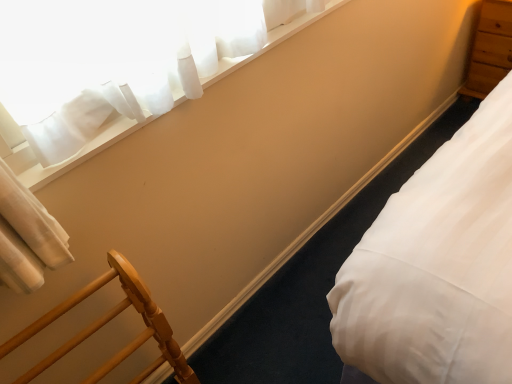
This screenshot has height=384, width=512. What are the coordinates of `empty space that is ontop of white sheer curtain at upper left (from a real-world perspective)` in the screenshot? It's located at (207, 70).